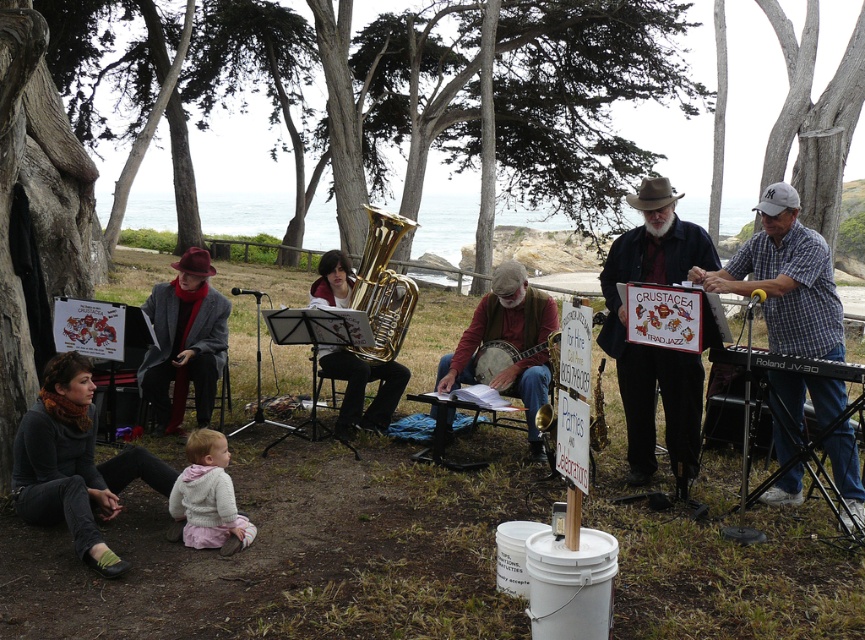
Question: Can you confirm if dark gray sweater at lower left is positioned below black plastic keyboard at right?

Choices:
 (A) yes
 (B) no

Answer: (A)

Question: Which object is positioned farthest from the black plastic keyboard at right?

Choices:
 (A) dark gray sweater at lower left
 (B) gold brass tuba at center
 (C) white checkered shirt at right
 (D) brown leather hat at center

Answer: (A)

Question: Can you confirm if white checkered shirt at right is positioned to the left of brown leather hat at center?

Choices:
 (A) no
 (B) yes

Answer: (A)

Question: Where is light gray fleece jacket at lower center located in relation to wooden banjo at center in the image?

Choices:
 (A) below
 (B) above

Answer: (A)

Question: Which point is closer to the camera?

Choices:
 (A) brown leather hat at center
 (B) light gray fleece jacket at lower center
 (C) white checkered shirt at right
 (D) matte gray coat at left

Answer: (B)

Question: Which object is positioned closest to the light gray fleece jacket at lower center?

Choices:
 (A) gold brass tuba at center
 (B) wooden banjo at center
 (C) dark gray sweater at lower left

Answer: (C)